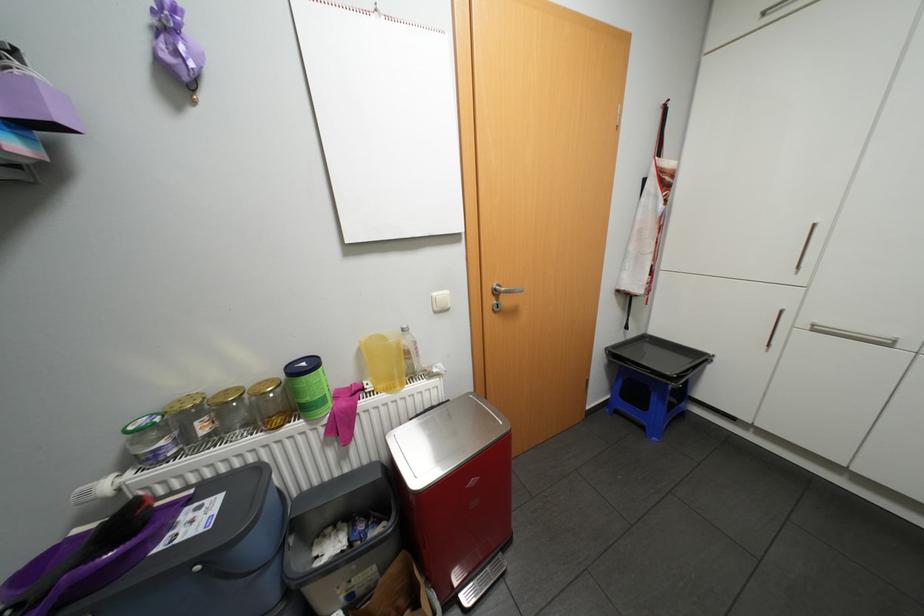
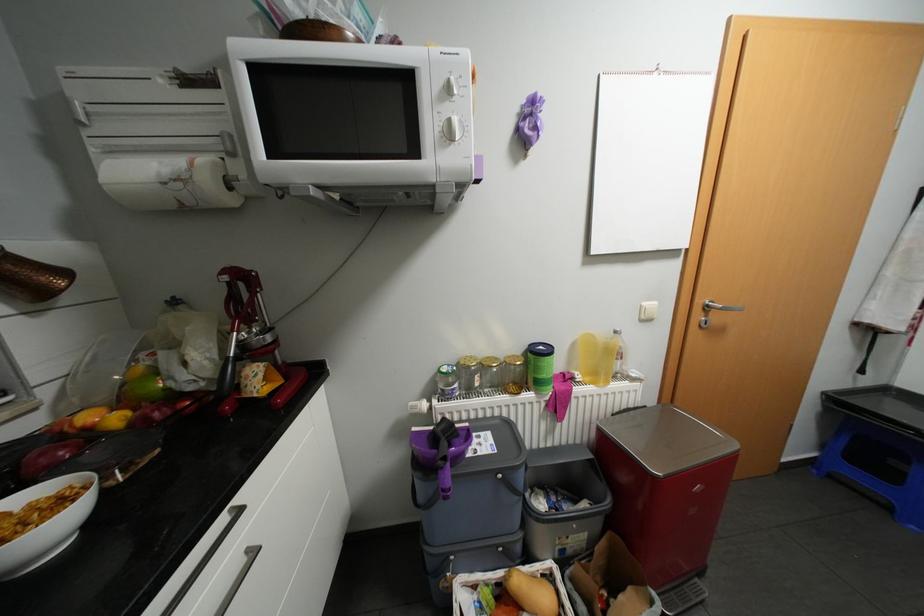
Locate, in the second image, the point that corresponds to [139,427] in the first image.

(452, 369)